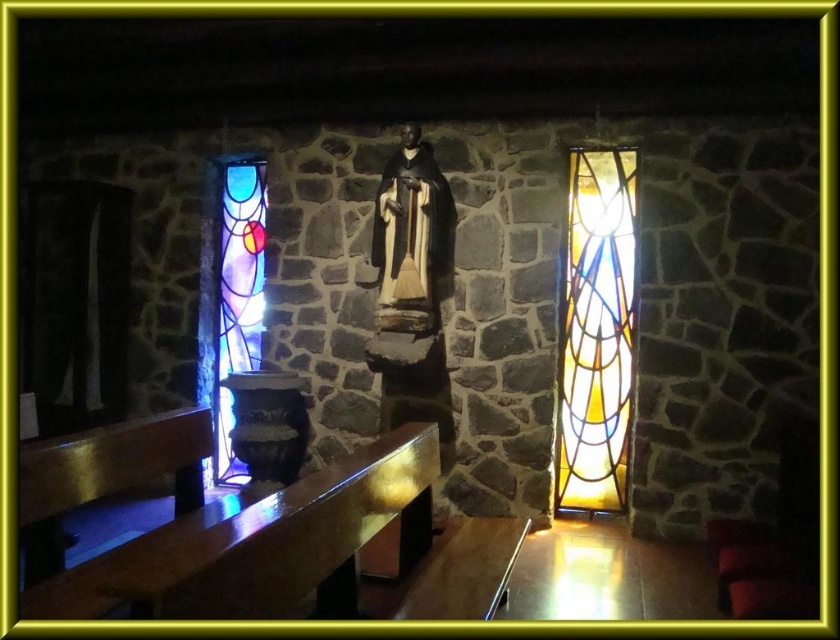
Is translucent stained glass at right to the left of stained glass window at left from the viewer's perspective?

In fact, translucent stained glass at right is to the right of stained glass window at left.

Based on the photo, who is lower down, translucent stained glass at right or stained glass window at left?

translucent stained glass at right is below.

Where is `translucent stained glass at right`? translucent stained glass at right is located at coordinates (596, 332).

Who is taller, polished wood bench at lower left or translucent stained glass at right?

translucent stained glass at right

What do you see at coordinates (303, 552) in the screenshot? I see `polished wood bench at lower left` at bounding box center [303, 552].

Which is in front, point (30, 588) or point (588, 285)?

Point (30, 588) is in front.

Find the location of a particular element. polished wood bench at lower left is located at coordinates (303, 552).

Does polished wood bench at lower left appear under stained glass window at left?

Indeed, polished wood bench at lower left is positioned under stained glass window at left.

From the picture: Which is more to the right, polished wood bench at lower left or stained glass window at left?

polished wood bench at lower left is more to the right.

I want to click on polished wood bench at lower left, so click(x=303, y=552).